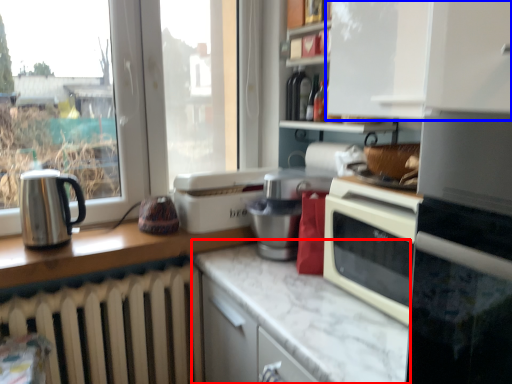
Question: Which of the following is the farthest to the observer, counter top (highlighted by a red box) or cabinetry (highlighted by a blue box)?

Choices:
 (A) counter top
 (B) cabinetry

Answer: (B)